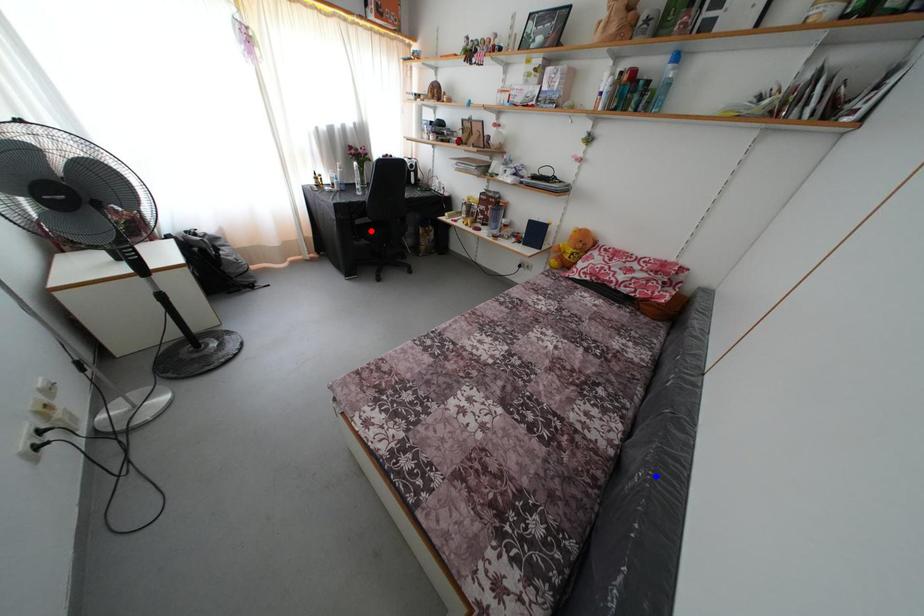
Question: Which of the two points in the image is closer to the camera?

Choices:
 (A) Blue point is closer.
 (B) Red point is closer.

Answer: (A)